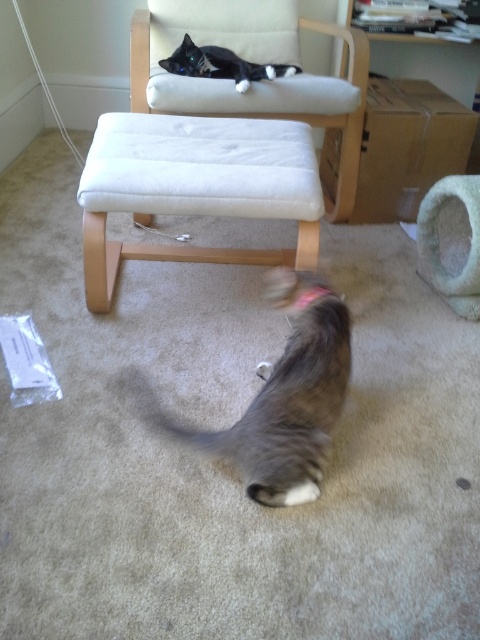
Question: Is light beige fabric armchair at upper center bigger than gray striped cat at lower center?

Choices:
 (A) yes
 (B) no

Answer: (A)

Question: Does light beige fabric armchair at upper center have a smaller size compared to soft green fabric cat bed at lower right?

Choices:
 (A) no
 (B) yes

Answer: (A)

Question: Among these objects, which one is nearest to the camera?

Choices:
 (A) black and white fur cat at upper center
 (B) gray striped cat at lower center

Answer: (B)

Question: Is white fabric stool at center positioned in front of soft green fabric cat bed at lower right?

Choices:
 (A) yes
 (B) no

Answer: (A)

Question: Which object is positioned closest to the white fabric stool at center?

Choices:
 (A) gray striped cat at lower center
 (B) light beige fabric armchair at upper center

Answer: (B)

Question: Which object appears closest to the camera in this image?

Choices:
 (A) soft green fabric cat bed at lower right
 (B) light beige fabric armchair at upper center

Answer: (A)